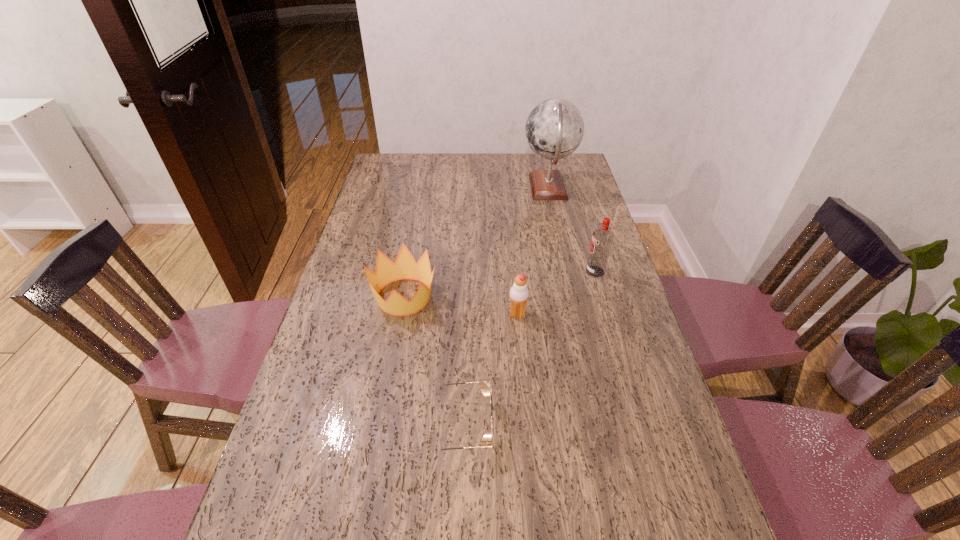
Identify the location of object present at the far edge. This screenshot has height=540, width=960. (554, 129).

You are a GUI agent. You are given a task and a screenshot of the screen. Output one action in this format:
    pyautogui.click(x=<x>, y=<y>)
    Task: Click on the object that is at the left edge
    The height and width of the screenshot is (540, 960).
    Given the screenshot: What is the action you would take?
    pyautogui.click(x=405, y=267)

This screenshot has height=540, width=960. I want to click on globe located in the right edge section of the desktop, so click(x=554, y=129).

Where is `vodka that is at the right edge`? The height and width of the screenshot is (540, 960). vodka that is at the right edge is located at coordinates (602, 239).

Locate an element on the screen. object at the far right corner is located at coordinates (554, 129).

The height and width of the screenshot is (540, 960). What are the coordinates of `free space at the far edge` in the screenshot? It's located at (518, 170).

At what (x,y) coordinates should I click in order to perform the action: click on blank space at the left edge of the desktop. Please return your answer as a coordinate pair (x, y). This screenshot has height=540, width=960. Looking at the image, I should click on pyautogui.click(x=304, y=377).

Image resolution: width=960 pixels, height=540 pixels. Find the location of `vacant space at the right edge of the desktop`. vacant space at the right edge of the desktop is located at coordinates (585, 225).

This screenshot has height=540, width=960. In order to click on free space at the far right corner in this screenshot , I will do `click(552, 167)`.

Identify the location of empty space that is in between the leftmost object and the fourth shortest object. The width and height of the screenshot is (960, 540). (499, 284).